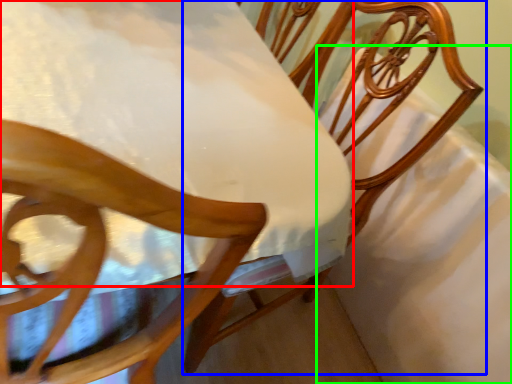
Question: Estimate the real-world distances between objects in this image. Which object is closer to table (highlighted by a red box), chair (highlighted by a blue box) or sheet (highlighted by a green box)?

Choices:
 (A) chair
 (B) sheet

Answer: (A)